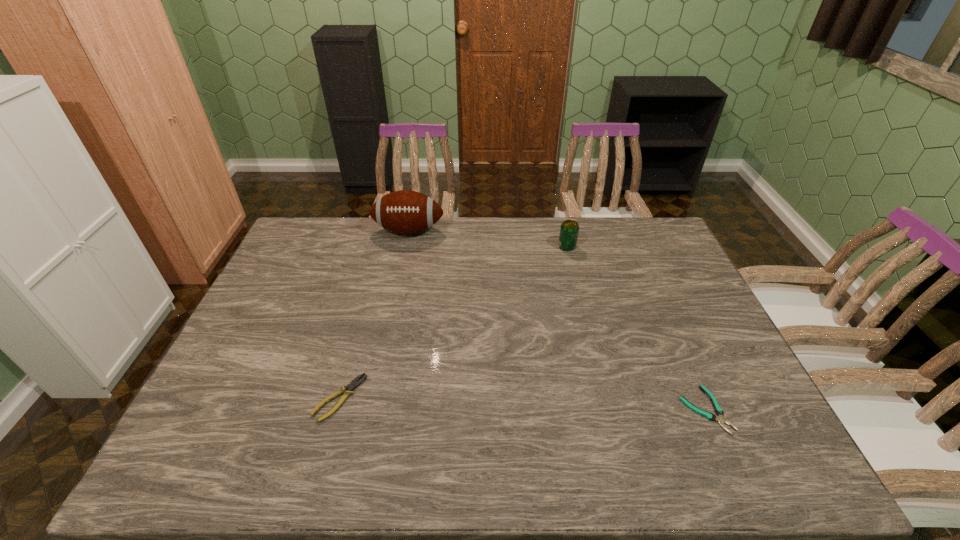
Image resolution: width=960 pixels, height=540 pixels. Find the location of `vacant point that satisfies the following two spatial constraints: 1. on the laces of the tallest object; 2. on the left side of the shortest object`. vacant point that satisfies the following two spatial constraints: 1. on the laces of the tallest object; 2. on the left side of the shortest object is located at coordinates (371, 409).